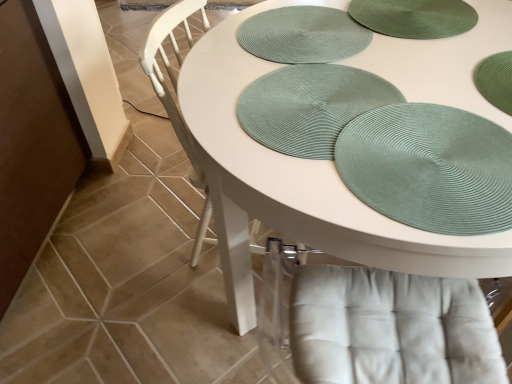
This screenshot has width=512, height=384. Find the location of `vacant area that is in front of green woven placemat at center, the 2th platter positioned from the back`. vacant area that is in front of green woven placemat at center, the 2th platter positioned from the back is located at coordinates (374, 192).